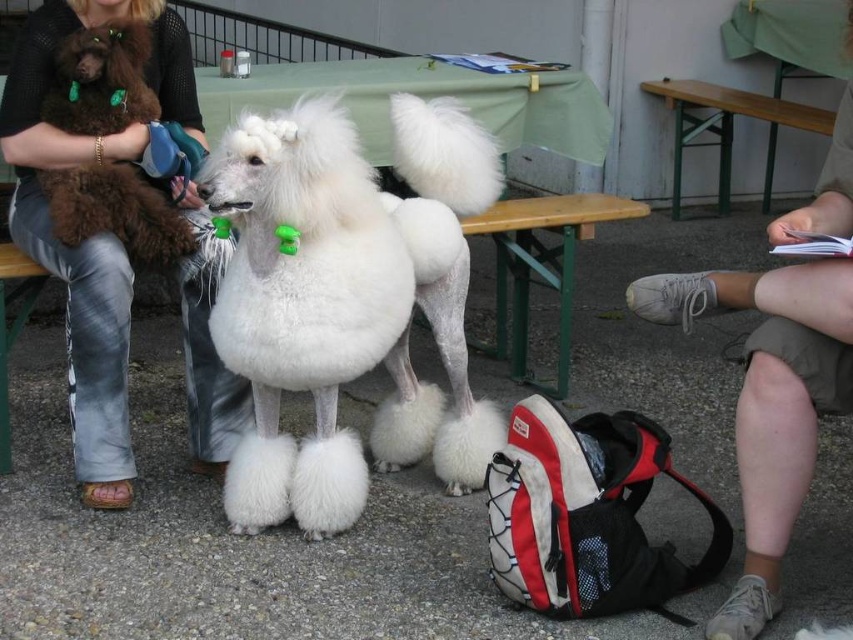
Question: Is white fluffy dog at center closer to camera compared to green painted wood picnic table at upper right?

Choices:
 (A) no
 (B) yes

Answer: (B)

Question: Among these objects, which one is nearest to the camera?

Choices:
 (A) shiny brown fur at left
 (B) brown fur coat at upper left
 (C) green painted wood picnic table at upper right

Answer: (A)

Question: Which object is farther from the camera taking this photo?

Choices:
 (A) green painted wood picnic table at upper right
 (B) brown fur coat at upper left
 (C) light brown shorts at lower right
 (D) shiny brown fur at left

Answer: (A)

Question: Does light brown shorts at lower right appear under green painted wood picnic table at upper right?

Choices:
 (A) no
 (B) yes

Answer: (B)

Question: Which is farther from the white fluffy dog at center?

Choices:
 (A) green painted wood picnic table at upper right
 (B) shiny brown fur at left

Answer: (A)

Question: Is white fluffy dog at center positioned behind green painted wood picnic table at upper right?

Choices:
 (A) yes
 (B) no

Answer: (B)